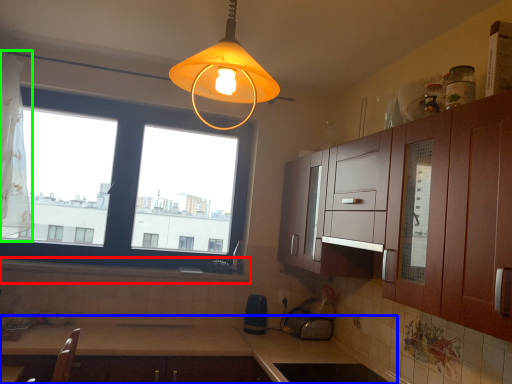
Question: Which object is positioned farthest from window sill (highlighted by a red box)? Select from countertop (highlighted by a blue box) and curtain (highlighted by a green box).

Choices:
 (A) countertop
 (B) curtain

Answer: (B)